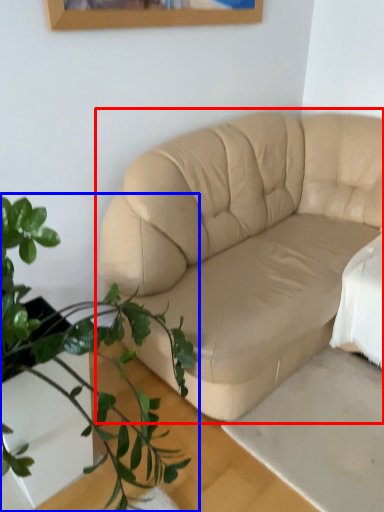
Question: Which object is further to the camera taking this photo, studio couch (highlighted by a red box) or houseplant (highlighted by a blue box)?

Choices:
 (A) studio couch
 (B) houseplant

Answer: (A)